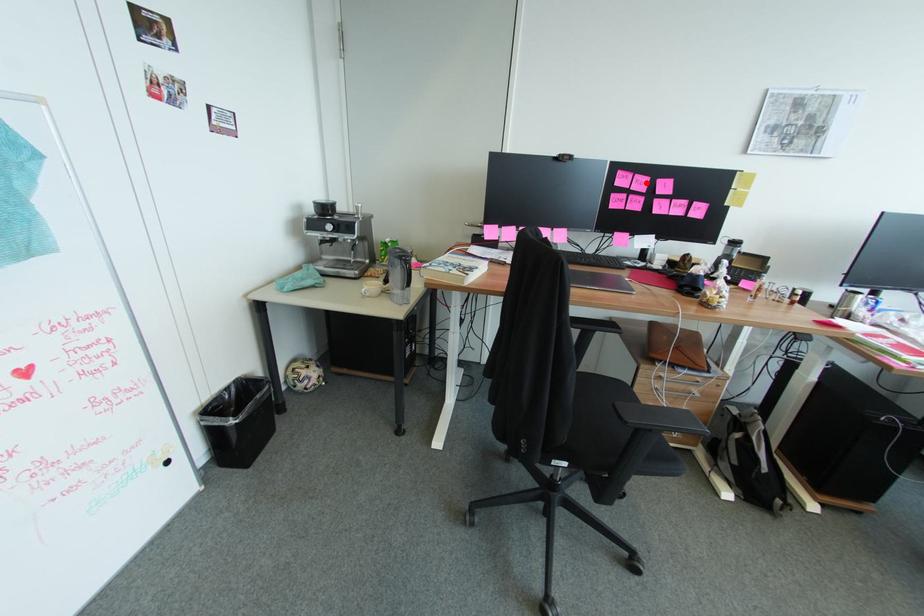
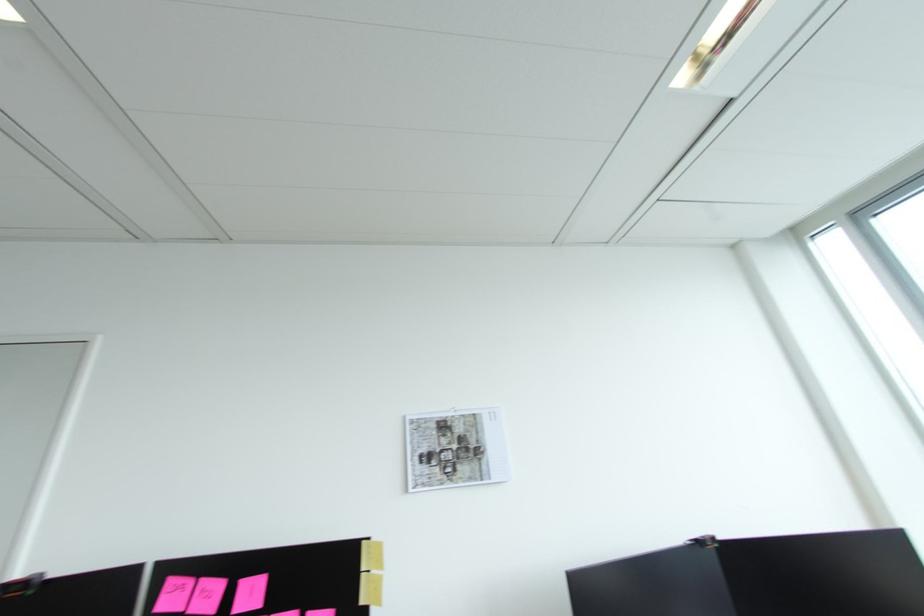
In the second image, find the point that corresponds to the highlighted location in the first image.

(213, 594)